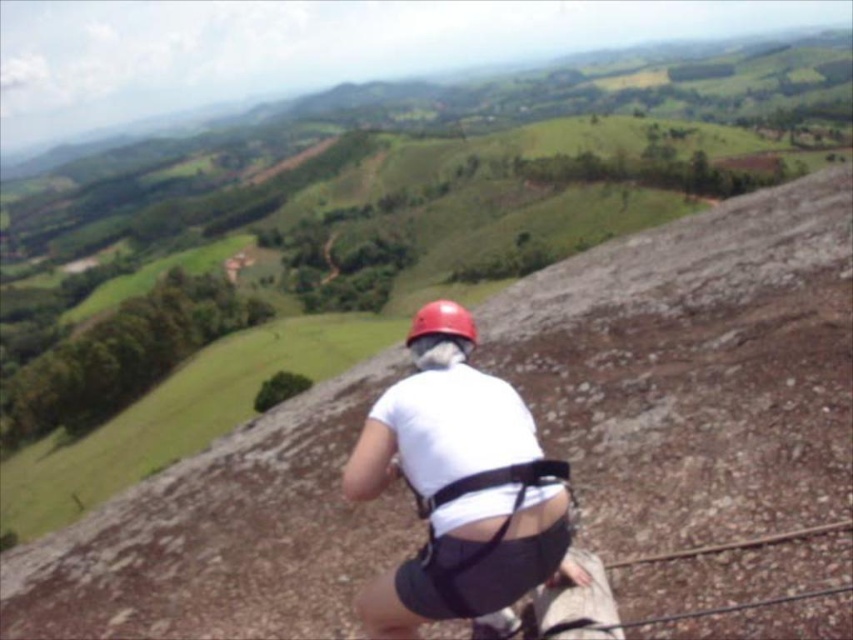
Question: Which object appears closest to the camera in this image?

Choices:
 (A) matte red helmet at center
 (B) white matte shirt at center

Answer: (B)

Question: Is white matte shirt at center below matte red helmet at center?

Choices:
 (A) yes
 (B) no

Answer: (A)

Question: Which of the following is the closest to the observer?

Choices:
 (A) (384, 465)
 (B) (468, 342)

Answer: (A)

Question: Does white matte shirt at center appear on the left side of matte red helmet at center?

Choices:
 (A) yes
 (B) no

Answer: (A)

Question: Does white matte shirt at center have a smaller size compared to matte red helmet at center?

Choices:
 (A) no
 (B) yes

Answer: (B)

Question: Which object is closer to the camera taking this photo?

Choices:
 (A) matte red helmet at center
 (B) white matte shirt at center

Answer: (B)